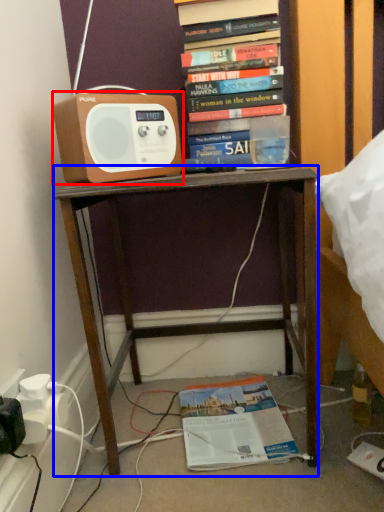
Question: Which of the following is the farthest to the observer, speaker (highlighted by a red box) or desk (highlighted by a blue box)?

Choices:
 (A) speaker
 (B) desk

Answer: (A)